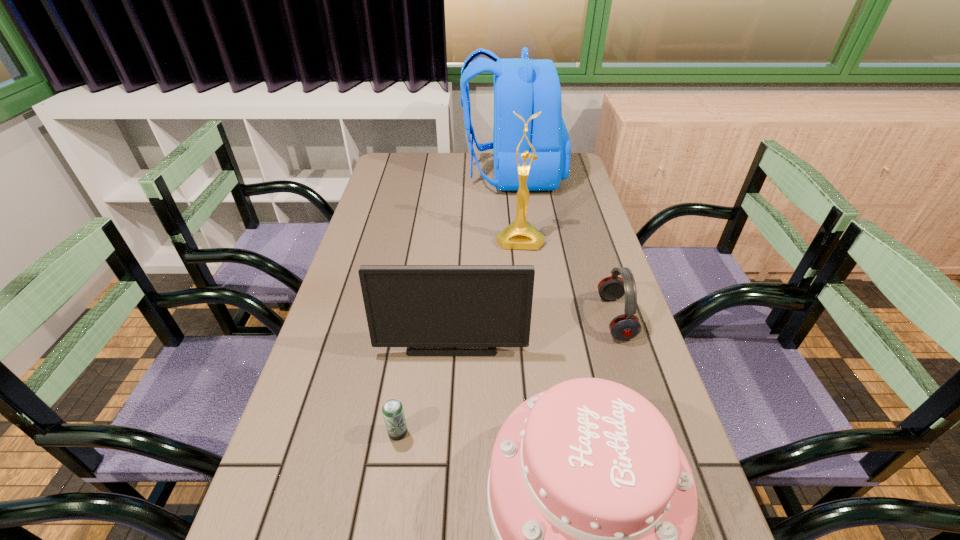
You are a GUI agent. You are given a task and a screenshot of the screen. Output one action in this format:
    pyautogui.click(x=<x>, y=<y>)
    Task: Click on the free space at the left edge
    The width and height of the screenshot is (960, 540).
    Given the screenshot: What is the action you would take?
    pyautogui.click(x=370, y=255)

Locate an element on the screen. free region at the right edge of the desktop is located at coordinates (574, 189).

You are a GUI agent. You are given a task and a screenshot of the screen. Output one action in this format:
    pyautogui.click(x=<x>, y=<y>)
    Task: Click on the vacant area that lies between the second shortest object and the beer can
    Image resolution: width=960 pixels, height=540 pixels.
    Given the screenshot: What is the action you would take?
    pyautogui.click(x=507, y=375)

This screenshot has height=540, width=960. I want to click on empty space that is in between the computer monitor and the fifth tallest object, so click(x=534, y=327).

The width and height of the screenshot is (960, 540). I want to click on free spot between the second farthest object and the backpack, so point(516,207).

This screenshot has width=960, height=540. What are the coordinates of `vacant point located between the fifth tallest object and the award` in the screenshot? It's located at (567, 278).

Locate an element on the screen. The image size is (960, 540). vacant space that is in between the computer monitor and the fifth tallest object is located at coordinates (534, 327).

This screenshot has width=960, height=540. Identify the location of free space between the farthest object and the earphone. (564, 246).

Point out which object is positioned as the third nearest to the farthest object. Please provide its 2D coordinates. Your answer should be formatted as a tuple, i.e. [(x, y)], where the tuple contains the x and y coordinates of a point satisfying the conditions above.

[(410, 306)]

Locate an element on the screen. The width and height of the screenshot is (960, 540). the third closest object to the award is located at coordinates (x=410, y=306).